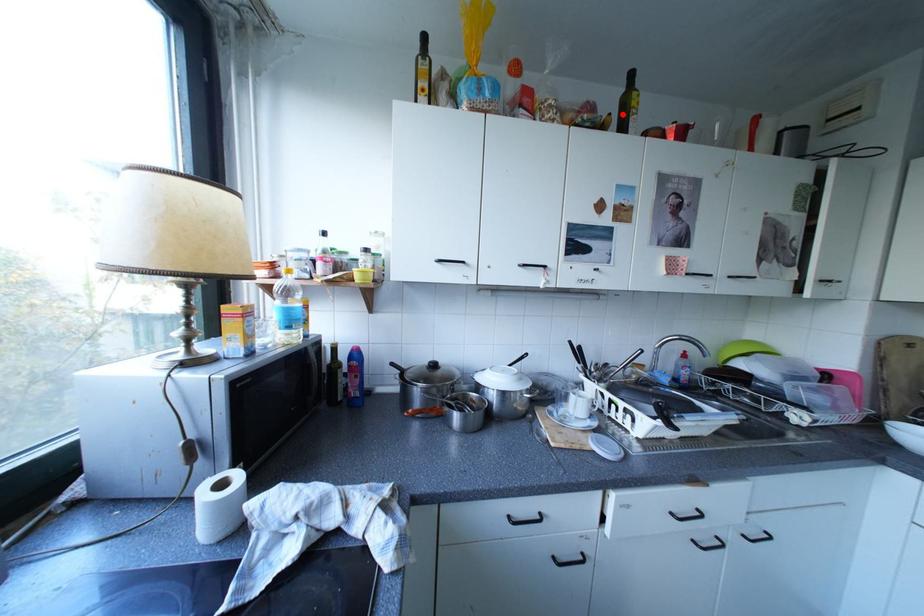
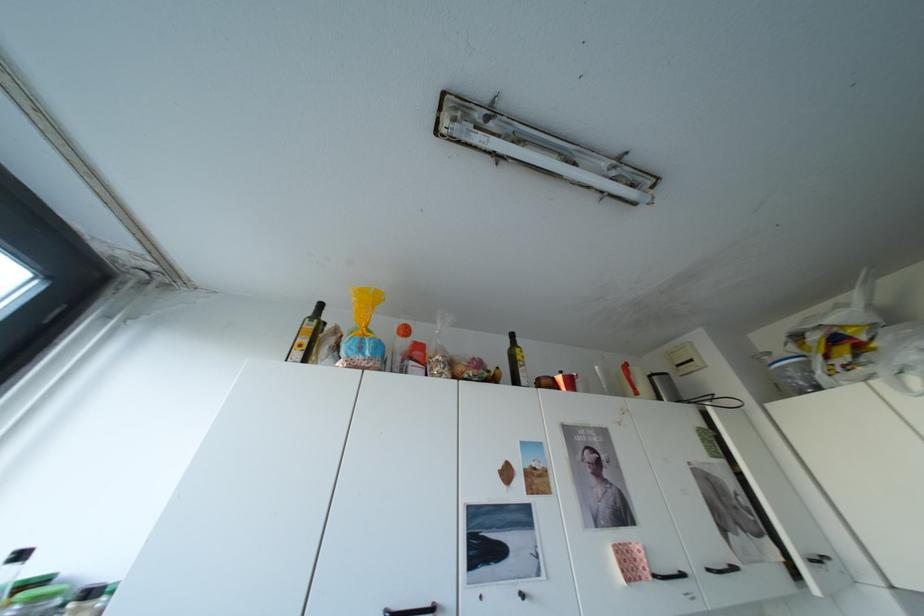
Where in the second image is the point corresponding to the highlighted location from the first image?

(511, 368)